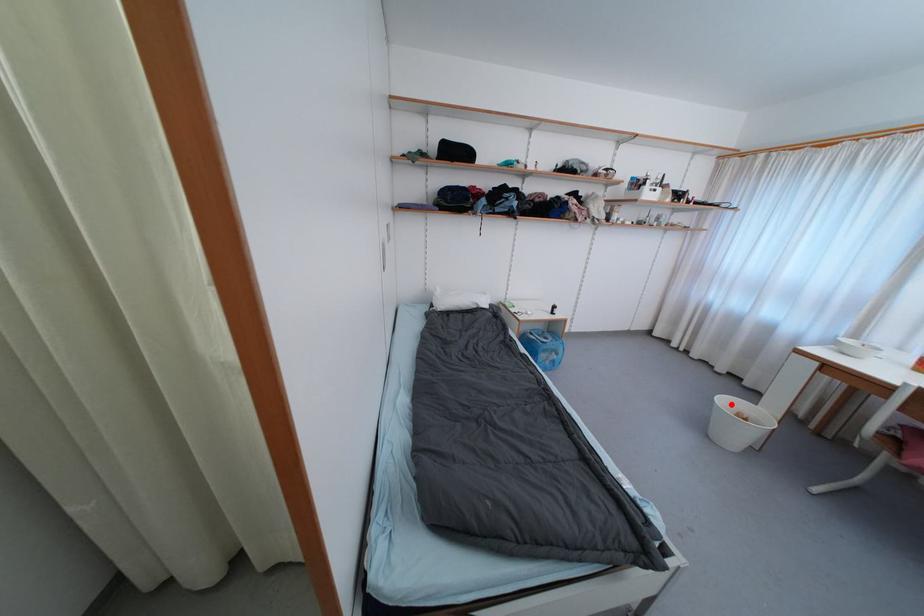
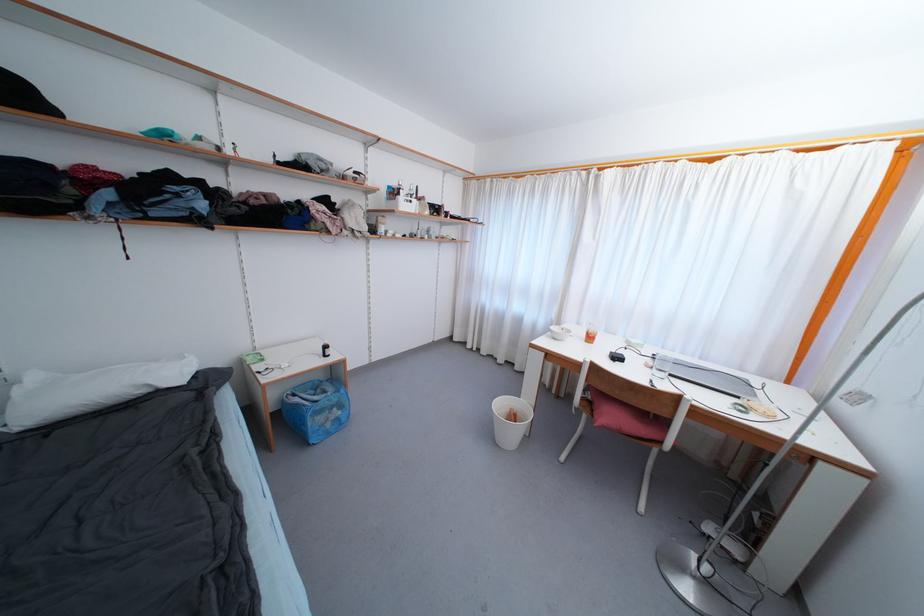
In the second image, find the point that corresponds to the highlighted location in the first image.

(505, 407)